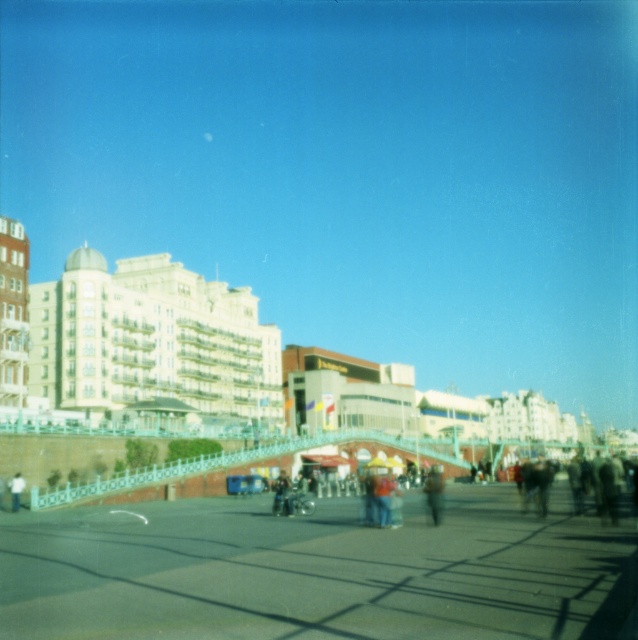
Question: Does brown fuzzy coat at center have a lesser width compared to dark blue jeans at center?

Choices:
 (A) yes
 (B) no

Answer: (B)

Question: Can you confirm if teal painted metal pedestrian bridge at center is positioned to the left of dark blue jeans at center?

Choices:
 (A) yes
 (B) no

Answer: (B)

Question: Can you confirm if teal painted metal pedestrian bridge at center is wider than dark gray concrete person at center?

Choices:
 (A) no
 (B) yes

Answer: (B)

Question: Which point is farther to the camera?

Choices:
 (A) dark gray concrete person at center
 (B) brown fuzzy coat at center
 (C) teal painted metal pedestrian bridge at center

Answer: (C)

Question: Which of the following is the closest to the observer?

Choices:
 (A) teal painted metal pedestrian bridge at center
 (B) denim pants at center
 (C) dark gray concrete person at center

Answer: (B)

Question: Which object is the closest to the dark gray concrete person at center?

Choices:
 (A) brown fuzzy coat at center
 (B) denim pants at center

Answer: (B)